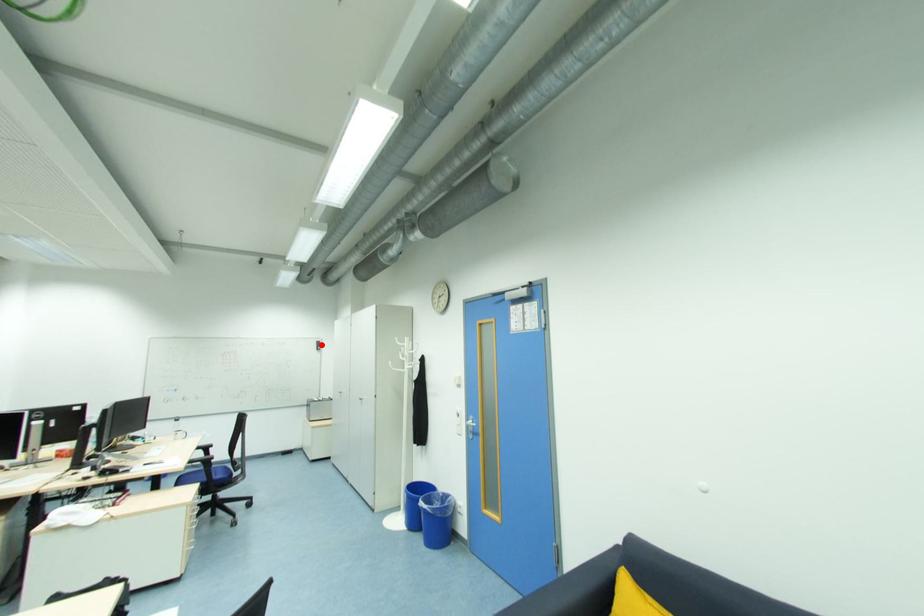
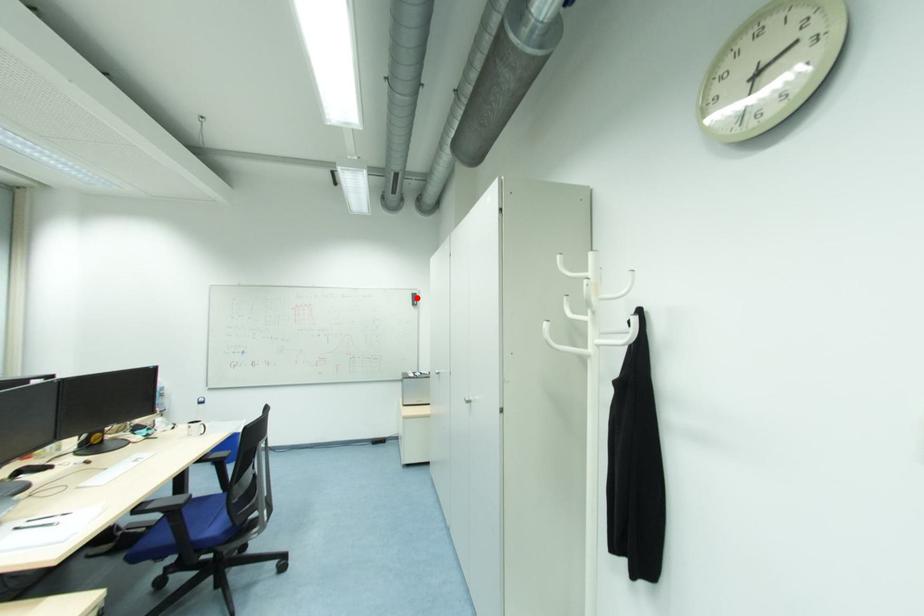
I am providing you with two images of the same scene from different viewpoints. A red point is marked on the first image and another point is marked on the second image. Does the point marked in image1 correspond to the same location as the one in image2?

Yes